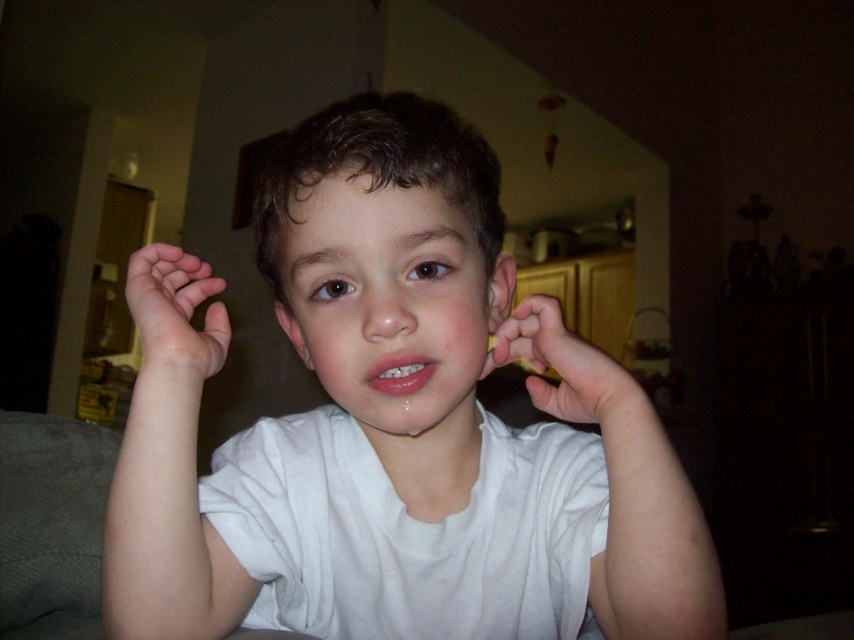
The child in the image is wearing a white cotton shirt at center and has matte white ear at center. Which of these two items has a greater width?

The white cotton shirt at center has a greater width than the matte white ear at center.

You are a photographer adjusting lighting in a dimly lit room. You notice the white cotton shirt at center and the matte white ear at center. Which object should you focus on first if you want to ensure proper exposure for the subject?

The matte white ear at center should be focused on first because the white cotton shirt at center is to the right of it, so adjusting exposure for the ear ensures the subject is properly lit.